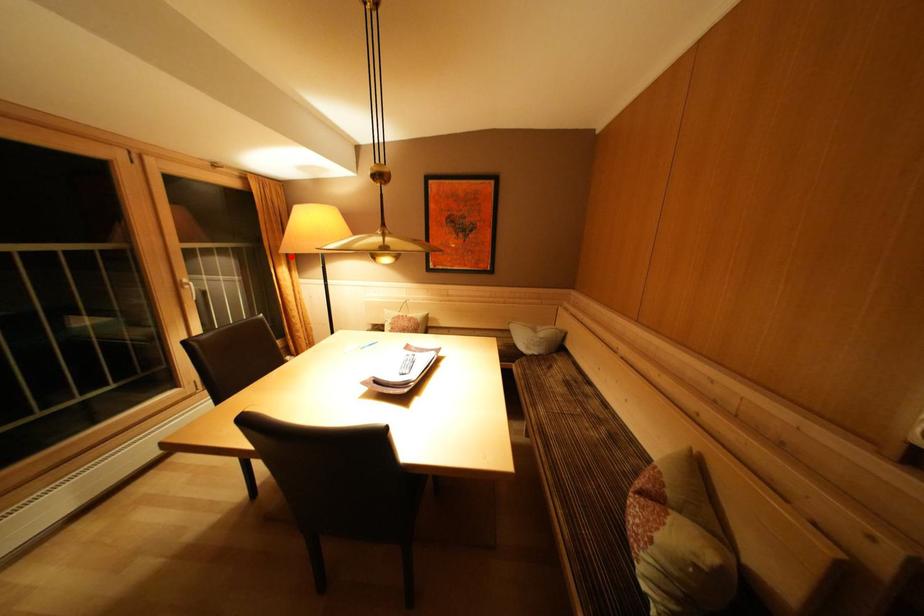
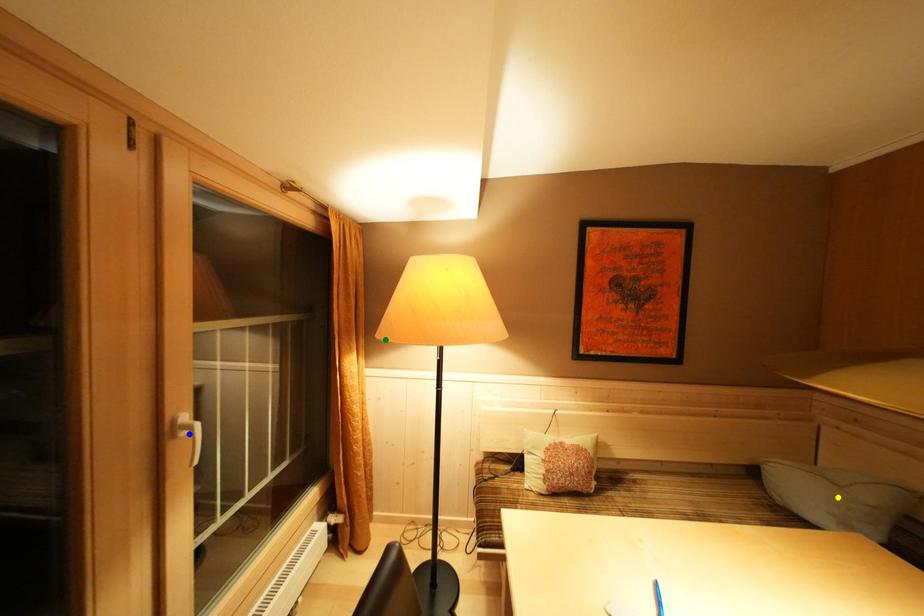
Question: I am providing you with two images of the same scene from different viewpoints. A red point is marked on the first image. You are given multiple points on the second image. Which mark in image 2 goes with the point in image 1?

Choices:
 (A) blue point
 (B) green point
 (C) yellow point

Answer: (B)